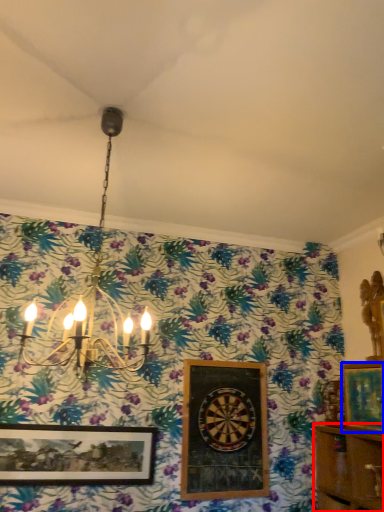
Question: Which object appears farthest to the camera in this image, shelf (highlighted by a red box) or picture frame (highlighted by a blue box)?

Choices:
 (A) shelf
 (B) picture frame

Answer: (B)